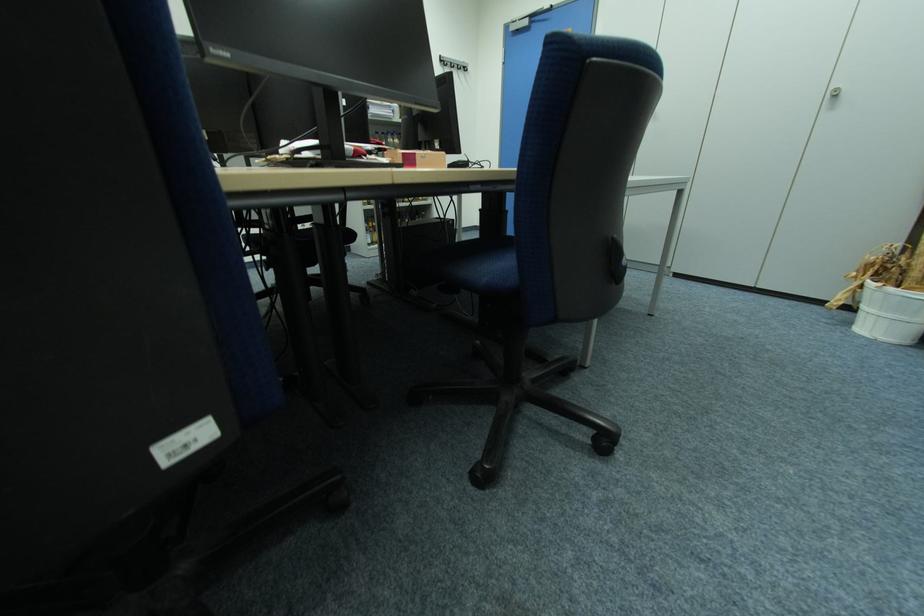
Find the location of a particular element. This screenshot has height=616, width=924. white cabinet handle is located at coordinates (834, 92).